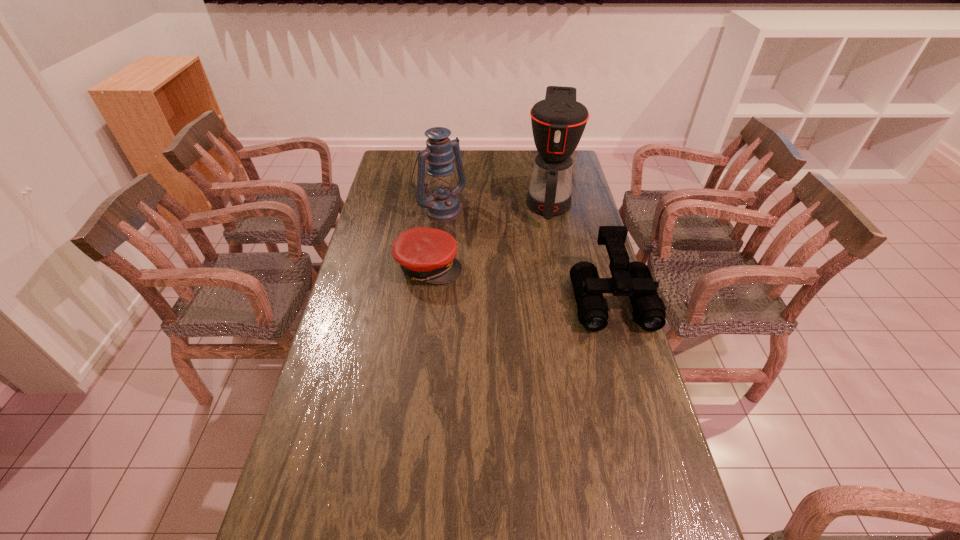
The image size is (960, 540). What are the coordinates of `free space on the desktop that is between the shortest object and the second shortest object and is positioned on the front-facing side of the lantern` in the screenshot? It's located at (531, 284).

Where is `vacant spot on the desktop that is between the shortest object and the second shortest object and is positioned pour from the carafe of the coffee maker`? vacant spot on the desktop that is between the shortest object and the second shortest object and is positioned pour from the carafe of the coffee maker is located at coordinates (540, 286).